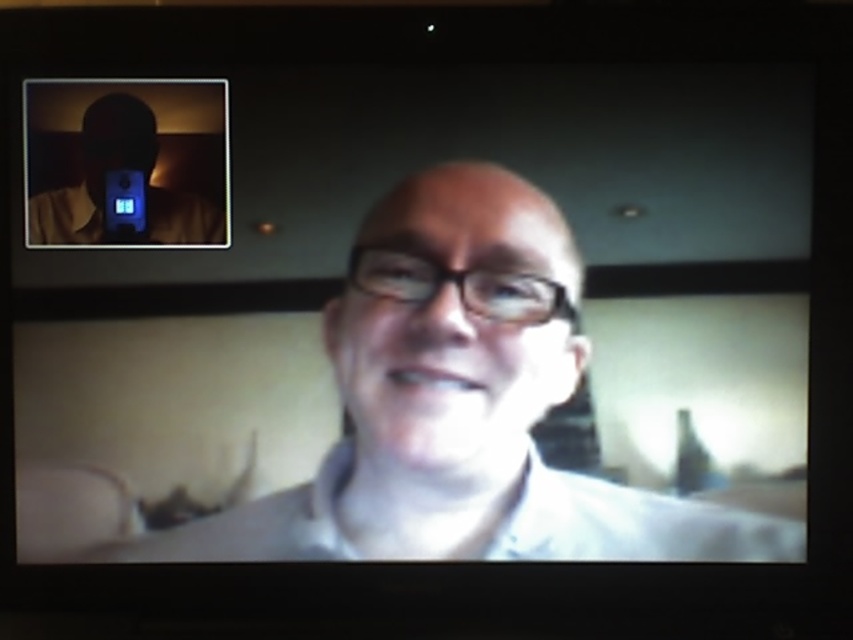
Does matte black phone at upper left have a greater width compared to blue plastic video camera at upper left?

Correct, the width of matte black phone at upper left exceeds that of blue plastic video camera at upper left.

Is point (146, 122) less distant than point (122, 186)?

No, (146, 122) is behind (122, 186).

The height and width of the screenshot is (640, 853). What are the coordinates of `matte black phone at upper left` in the screenshot? It's located at (126, 163).

The height and width of the screenshot is (640, 853). Identify the location of matte black phone at upper left. (126, 163).